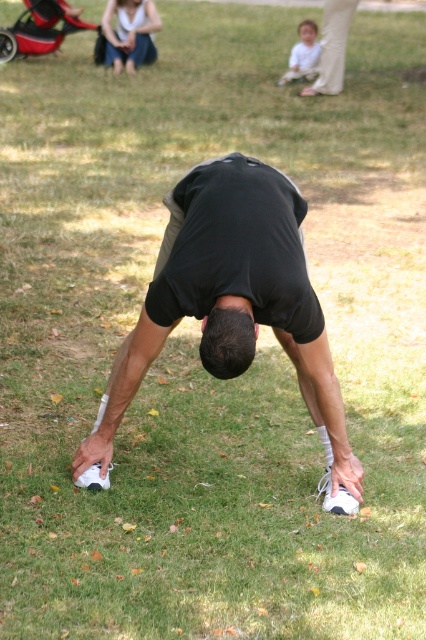
You are a photographer setting up for a family photo shoot. You need to ensure the black matte shorts at center and the red plastic baby carriage at upper left are both visible in the frame. Based on their positions, which object is closer to the camera?

The black matte shorts at center is located below the red plastic baby carriage at upper left, meaning it is closer to the camera since it appears lower in the image.

You are standing at the camera position and want to reach the point marked as point (109, 38). If you walk straight ahead, will you reach that point within 15 meters?

Yes, because the point (109, 38) is 14.27 meters away from the camera, which is within the 15 meters distance.

You are a photographer trying to capture the best angle of the person doing the forward bend. You notice two points marked in the scene. Which point, point 1 at coordinates point (193, 257) or point 2 at coordinates point (123, 4), is closer to you and thus would be better for framing the subject?

Point 1 at coordinates point (193, 257) is closer to the viewer, making it the better choice for framing the subject as it provides a more prominent perspective.